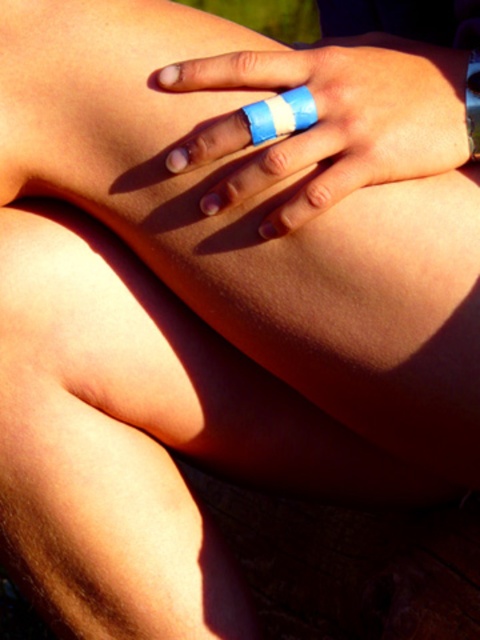
You are a nurse assessing a patient who has two bandages on their hand. The blue striped bandage at center and the blue tape bandage at center. Which one has a bigger size?

The blue striped bandage at center is larger in size than the blue tape bandage at center.

You are a photographer adjusting your camera settings. You notice a point at coordinates point [347,116] in the image that needs to be in focus. If your camera can focus on objects within 20 inches, will this point be in focus?

The point [347,116] is 22.48 inches from the viewer, which is beyond the camera focus range of 20 inches. Therefore, the point will not be in focus.